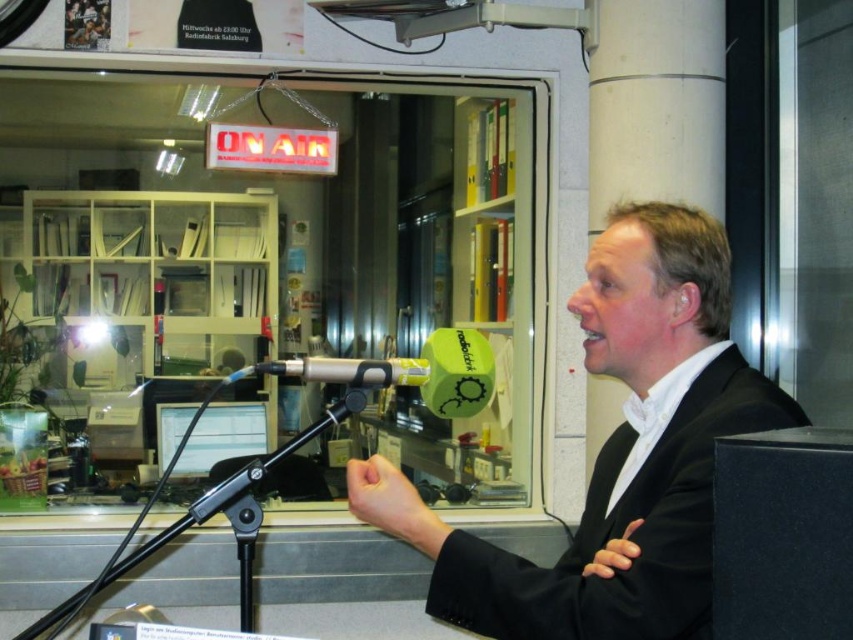
Between matte black suit at center and metallic silver microphone at center, which one appears on the right side from the viewer's perspective?

matte black suit at center is more to the right.

Is matte black suit at center to the right of metallic silver microphone at center from the viewer's perspective?

Yes, matte black suit at center is to the right of metallic silver microphone at center.

I want to click on matte black suit at center, so click(x=616, y=452).